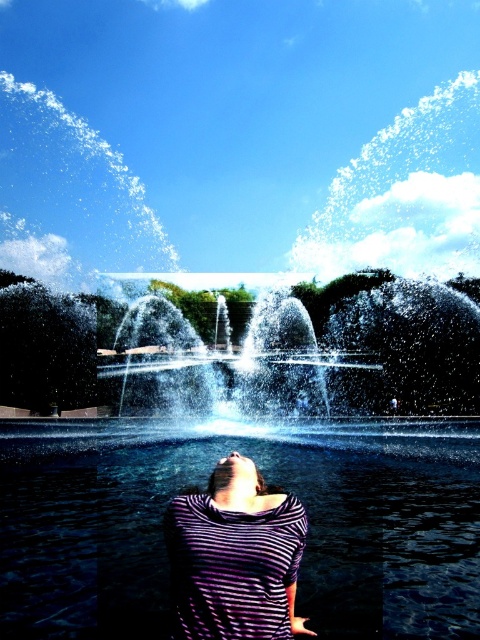
Is clear water at center bigger than purple striped shirt at center?

Indeed, clear water at center has a larger size compared to purple striped shirt at center.

Can you confirm if clear water at center is taller than purple striped shirt at center?

No, clear water at center is not taller than purple striped shirt at center.

Between point (317, 420) and point (312, 634), which one is positioned behind?

Point (317, 420)

You are a GUI agent. You are given a task and a screenshot of the screen. Output one action in this format:
    pyautogui.click(x=<x>, y=<y>)
    Task: Click on the clear water at center
    This screenshot has width=480, height=640.
    Given the screenshot: What is the action you would take?
    pyautogui.click(x=267, y=481)